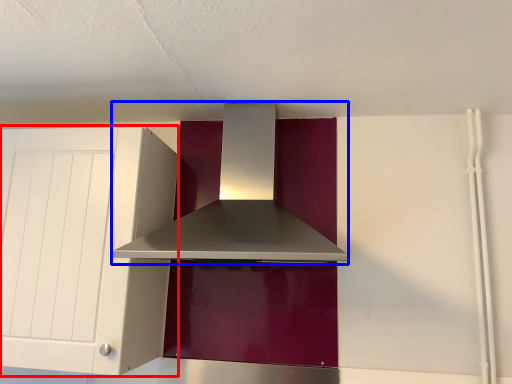
Question: Among these objects, which one is farthest to the camera, cabinetry (highlighted by a red box) or home appliance (highlighted by a blue box)?

Choices:
 (A) cabinetry
 (B) home appliance

Answer: (A)